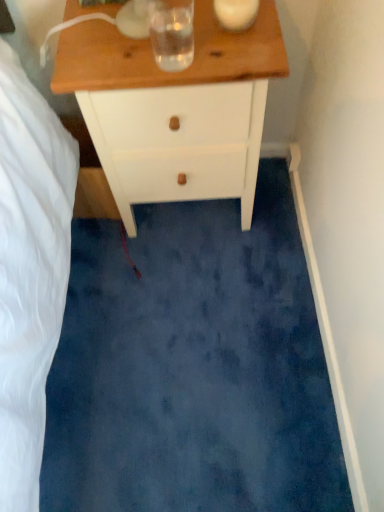
This screenshot has height=512, width=384. I want to click on vacant space situated above white wood chest of drawers at upper center (from a real-world perspective), so click(158, 36).